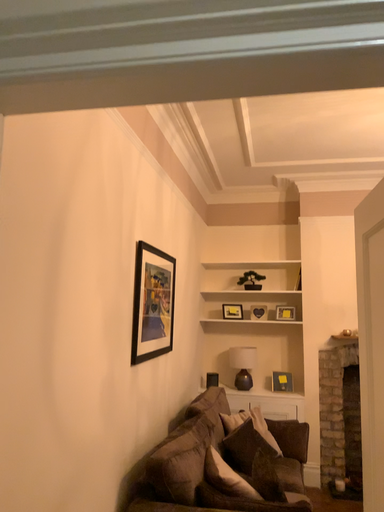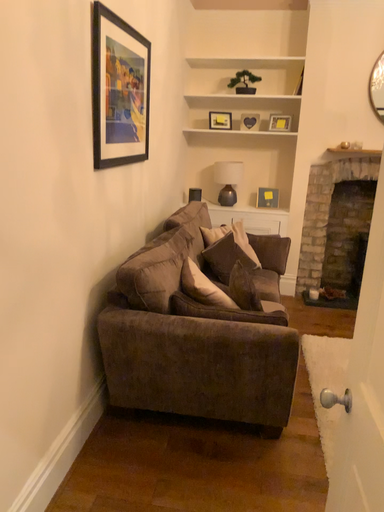
Question: How did the camera likely rotate when shooting the video?

Choices:
 (A) rotated downward
 (B) rotated upward

Answer: (A)